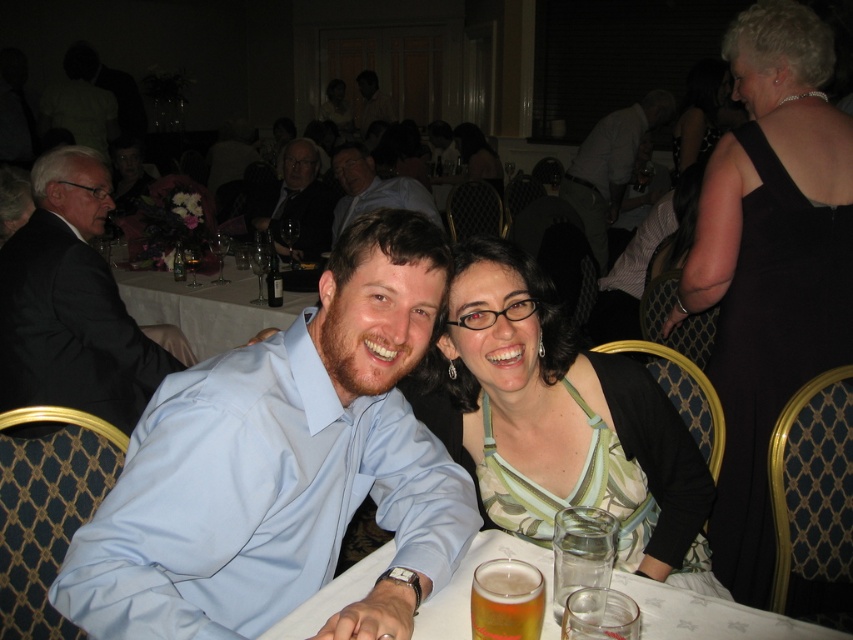
Is black suit at left in front of white cloth at center?

Yes, black suit at left is in front of white cloth at center.

Describe the element at coordinates (71, 304) in the screenshot. I see `black suit at left` at that location.

Locate an element on the screen. This screenshot has height=640, width=853. black suit at left is located at coordinates (71, 304).

Who is taller, clear glass beer at center or matte black suit at upper center?

With more height is matte black suit at upper center.

Which is behind, point (312, 598) or point (293, 172)?

Positioned behind is point (293, 172).

This screenshot has width=853, height=640. I want to click on clear glass beer at center, so click(x=708, y=616).

Is clear glass beer at center to the left of white cloth at center from the viewer's perspective?

Incorrect, clear glass beer at center is not on the left side of white cloth at center.

Who is shorter, clear glass beer at center or white cloth at center?

With less height is clear glass beer at center.

Is point (447, 616) in front of point (258, 323)?

Yes, point (447, 616) is closer to viewer.

Image resolution: width=853 pixels, height=640 pixels. I want to click on clear glass beer at center, so click(x=708, y=616).